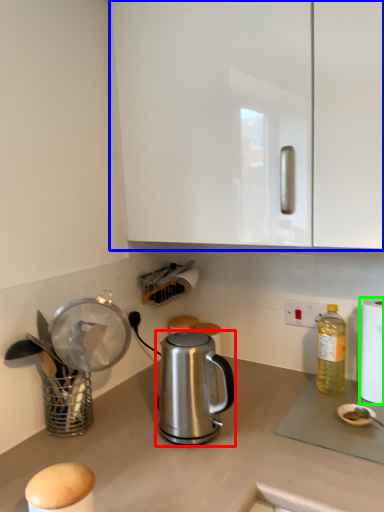
Question: Which object is positioned closest to kettle (highlighted by a red box)? Select from cabinetry (highlighted by a blue box) and paper towel (highlighted by a green box).

Choices:
 (A) cabinetry
 (B) paper towel

Answer: (B)